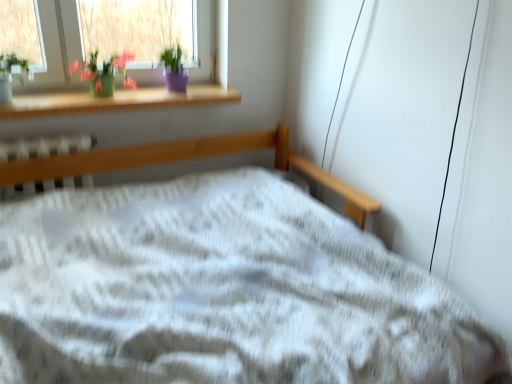
Question: Is green matte vase at upper left taller or shorter than wooden at upper left?

Choices:
 (A) tall
 (B) short

Answer: (A)

Question: Is green matte vase at upper left inside or outside of wooden at upper left?

Choices:
 (A) inside
 (B) outside

Answer: (B)

Question: Considering the real-world distances, which object is farthest from the green matte vase at upper left?

Choices:
 (A) white plastic radiator at center
 (B) wooden at upper left

Answer: (A)

Question: Which object is positioned closest to the wooden at upper left?

Choices:
 (A) white plastic radiator at center
 (B) green matte vase at upper left

Answer: (B)